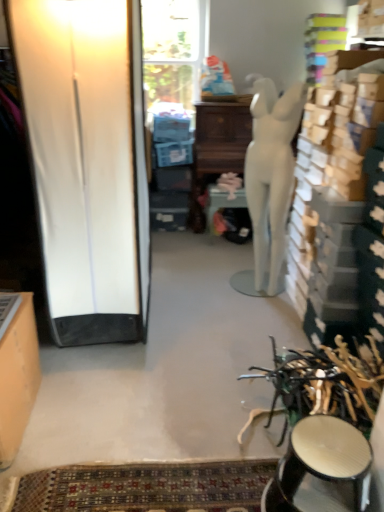
Question: Is white glossy screen door at left taller or shorter than matte orange cabinet at left?

Choices:
 (A) tall
 (B) short

Answer: (A)

Question: In terms of size, does white glossy screen door at left appear bigger or smaller than matte orange cabinet at left?

Choices:
 (A) big
 (B) small

Answer: (A)

Question: Based on their relative distances, which object is farther from the white glossy screen door at left?

Choices:
 (A) white matte mannequin at center
 (B) shiny metallic stool at lower right
 (C) patterned carpet at lower center
 (D) matte orange cabinet at left

Answer: (B)

Question: Which is nearer to the patterned carpet at lower center?

Choices:
 (A) matte orange cabinet at left
 (B) shiny metallic stool at lower right
 (C) white glossy screen door at left
 (D) white matte mannequin at center

Answer: (B)